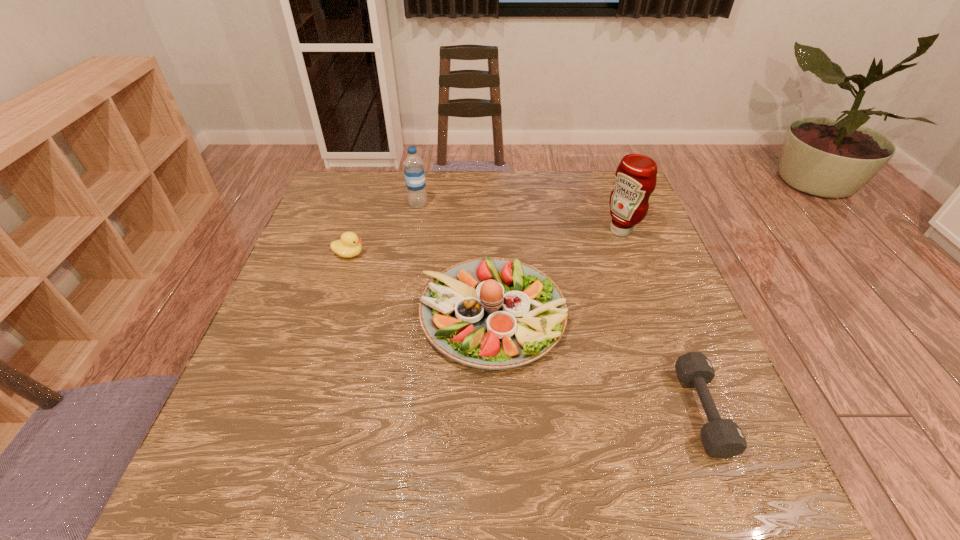
Identify the location of vacant space located 0.350m on the label of the water bottle. (402, 296).

This screenshot has width=960, height=540. Identify the location of vacant space positioned 0.200m on the back of the third object from left to right. (490, 219).

Find the location of `vacant point located on the beak of the leftmost object`. vacant point located on the beak of the leftmost object is located at coordinates (468, 254).

Locate an element on the screen. The height and width of the screenshot is (540, 960). vacant region located 0.170m on the left of the dumbbell is located at coordinates (596, 410).

Find the location of a particular element. object located in the far edge section of the desktop is located at coordinates (413, 165).

Where is `object that is at the near edge`? This screenshot has width=960, height=540. object that is at the near edge is located at coordinates (722, 438).

At what (x,y) coordinates should I click in order to perform the action: click on object that is at the left edge. Please return your answer as a coordinate pair (x, y). Image resolution: width=960 pixels, height=540 pixels. Looking at the image, I should click on (349, 245).

In order to click on condiment at the right edge in this screenshot , I will do `click(636, 176)`.

Image resolution: width=960 pixels, height=540 pixels. I want to click on dumbbell located at the right edge, so click(x=722, y=438).

The image size is (960, 540). Identify the location of object at the near right corner. (722, 438).